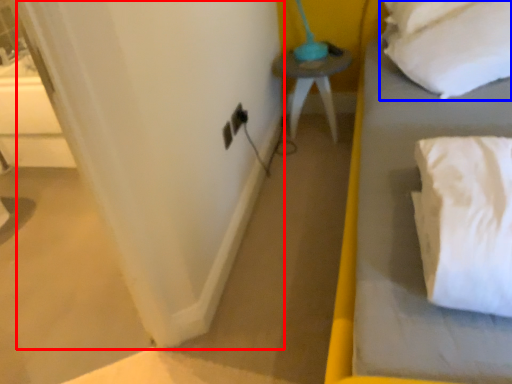
Question: Which object appears closest to the camera in this image, curtain (highlighted by a red box) or pillow (highlighted by a blue box)?

Choices:
 (A) curtain
 (B) pillow

Answer: (A)